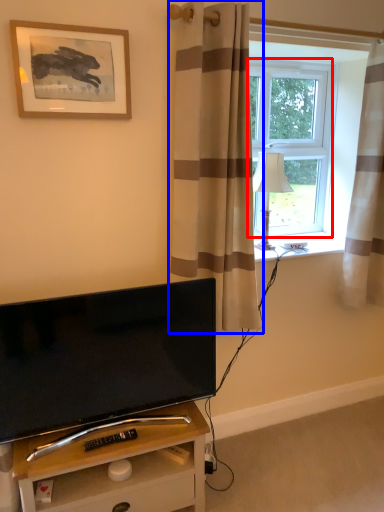
Question: Which object is further to the camera taking this photo, window screen (highlighted by a red box) or curtain (highlighted by a blue box)?

Choices:
 (A) window screen
 (B) curtain

Answer: (A)